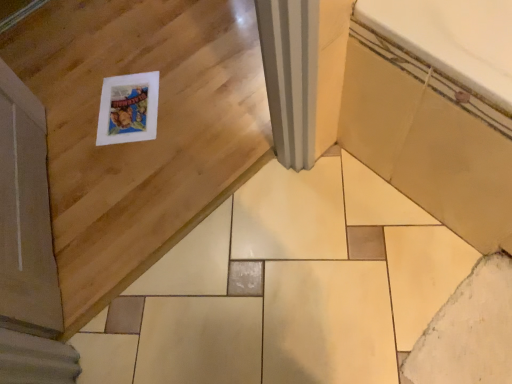
Question: In the image, is beige ceramic bathtub at lower right positioned in front of or behind white matte ceramic tile at lower right?

Choices:
 (A) behind
 (B) front

Answer: (B)

Question: In terms of size, does beige ceramic bathtub at lower right appear bigger or smaller than white matte ceramic tile at lower right?

Choices:
 (A) big
 (B) small

Answer: (A)

Question: Is beige ceramic bathtub at lower right taller or shorter than white matte ceramic tile at lower right?

Choices:
 (A) tall
 (B) short

Answer: (A)

Question: From a real-world perspective, is white matte ceramic tile at lower right above or below beige ceramic bathtub at lower right?

Choices:
 (A) above
 (B) below

Answer: (B)

Question: Considering the positions of white matte ceramic tile at lower right and beige ceramic bathtub at lower right in the image, is white matte ceramic tile at lower right taller or shorter than beige ceramic bathtub at lower right?

Choices:
 (A) short
 (B) tall

Answer: (A)

Question: Looking at the image, does white matte ceramic tile at lower right seem bigger or smaller compared to beige ceramic bathtub at lower right?

Choices:
 (A) small
 (B) big

Answer: (A)

Question: Do you think white matte ceramic tile at lower right is within beige ceramic bathtub at lower right, or outside of it?

Choices:
 (A) inside
 (B) outside

Answer: (B)